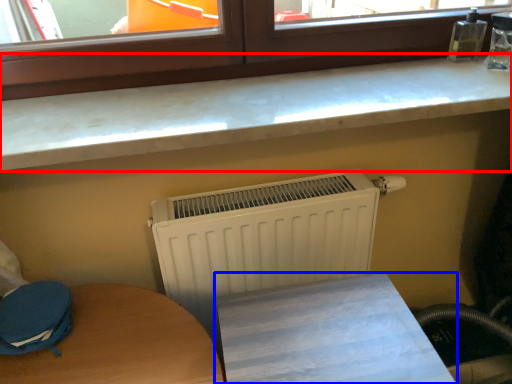
Question: Which object appears closest to the camera in this image, countertop (highlighted by a red box) or furniture (highlighted by a blue box)?

Choices:
 (A) countertop
 (B) furniture

Answer: (B)